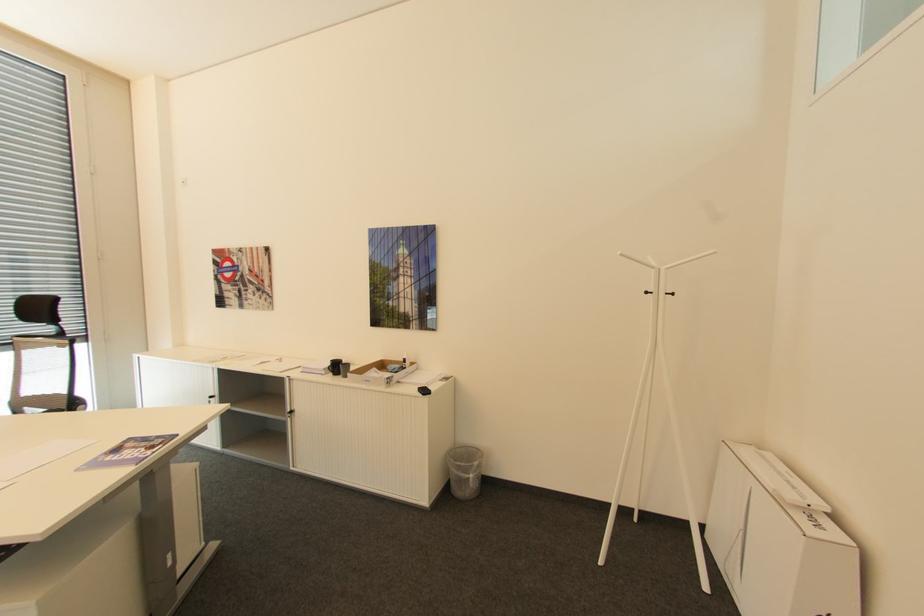
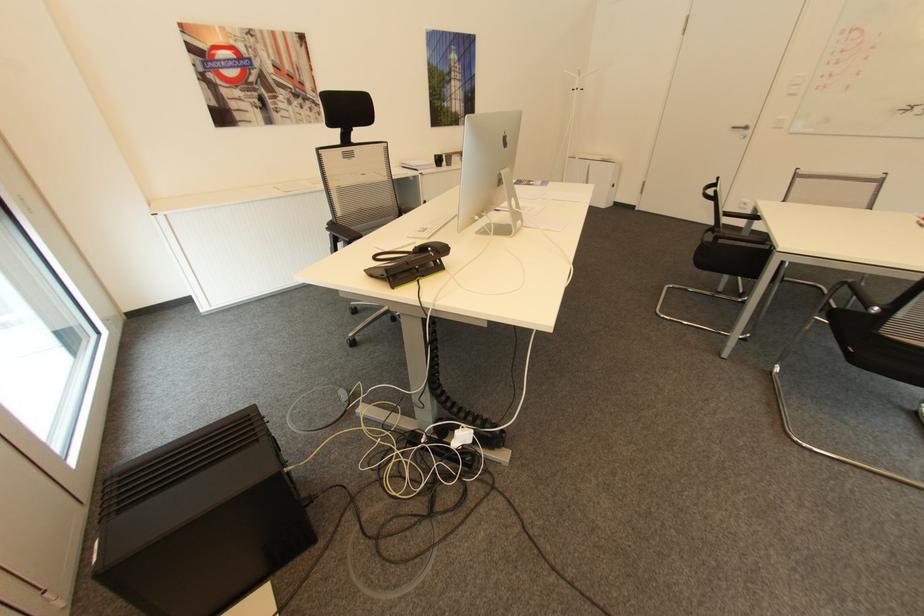
In the second image, find the point that corresponds to the point at 275,294 in the first image.

(322, 102)